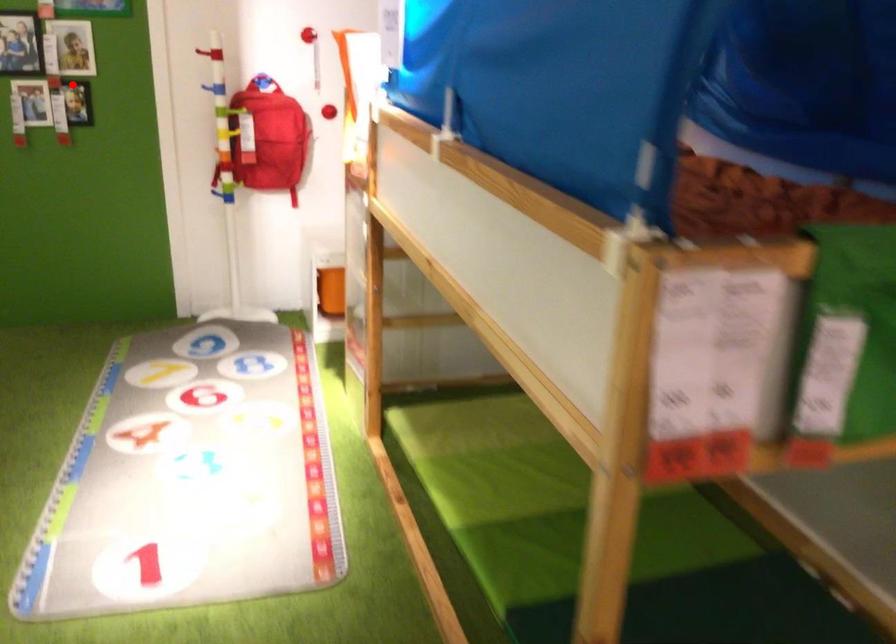
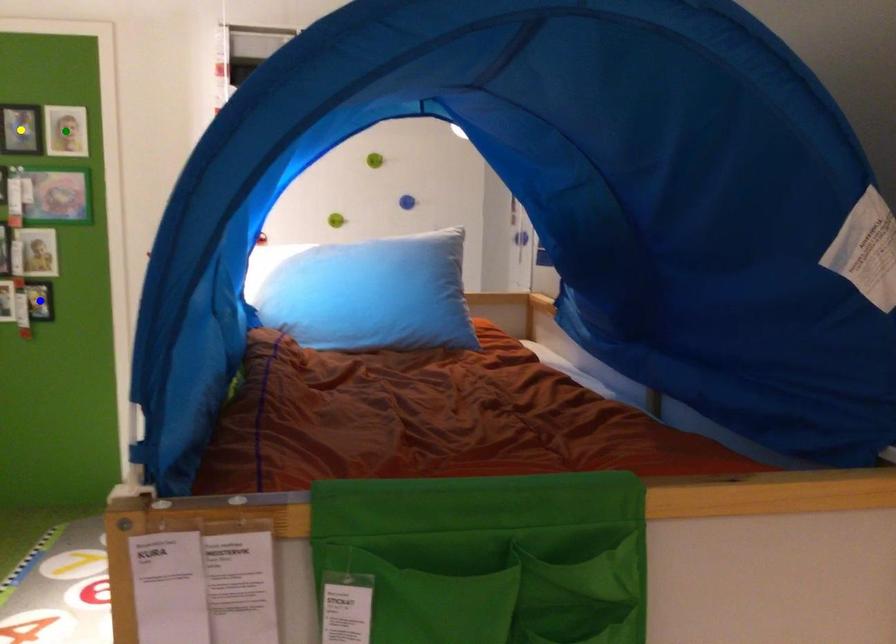
Question: I am providing you with two images of the same scene from different viewpoints. A red point is marked on the first image. You are given multiple points on the second image. Which mark in image 2 goes with the point in image 1?

Choices:
 (A) blue point
 (B) green point
 (C) yellow point

Answer: (A)